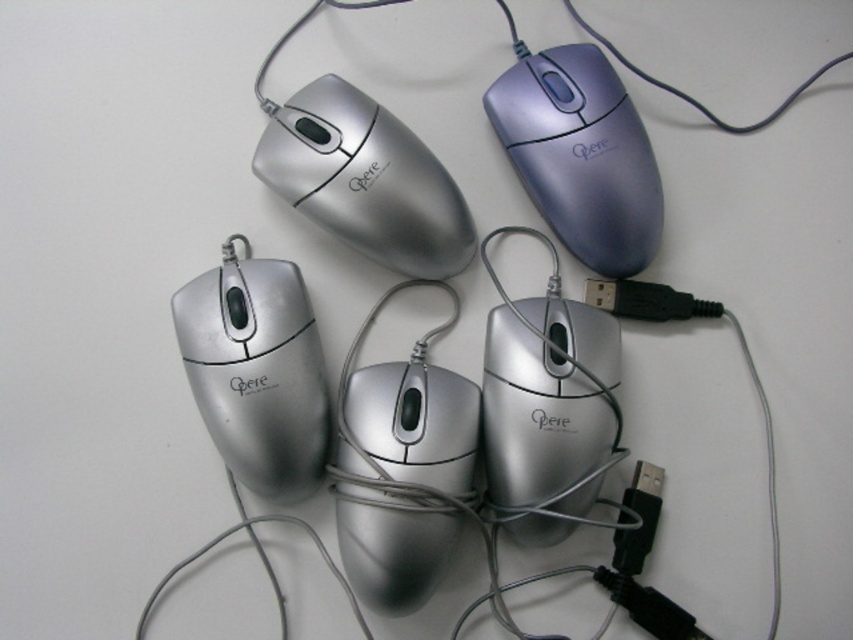
Question: Considering the relative positions of silver metallic mouse at center and matte silver mouse at upper left in the image provided, where is silver metallic mouse at center located with respect to matte silver mouse at upper left?

Choices:
 (A) left
 (B) right

Answer: (B)

Question: Among these objects, which one is nearest to the camera?

Choices:
 (A) black plastic usb plug at center right
 (B) silver metallic mouse at center

Answer: (B)

Question: Estimate the real-world distances between objects in this image. Which object is farther from the black plastic usb plug at center right?

Choices:
 (A) metallic blue mouse at upper right
 (B) silver metallic mouse at center

Answer: (B)

Question: Considering the relative positions of silver metallic mouse at center-left and black plastic usb plug at center right in the image provided, where is silver metallic mouse at center-left located with respect to black plastic usb plug at center right?

Choices:
 (A) right
 (B) left

Answer: (B)

Question: Which point is closer to the camera?

Choices:
 (A) (299, 305)
 (B) (582, 93)
 (C) (380, 204)
 (D) (665, 296)

Answer: (A)

Question: Is silver metallic mouse at center-left wider than matte silver mouse at upper left?

Choices:
 (A) yes
 (B) no

Answer: (B)